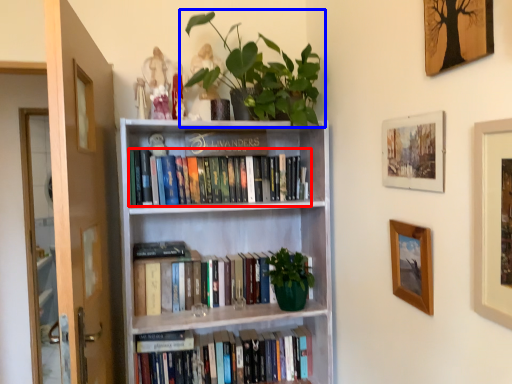
Question: Which object is closer to the camera taking this photo, book (highlighted by a red box) or houseplant (highlighted by a blue box)?

Choices:
 (A) book
 (B) houseplant

Answer: (B)